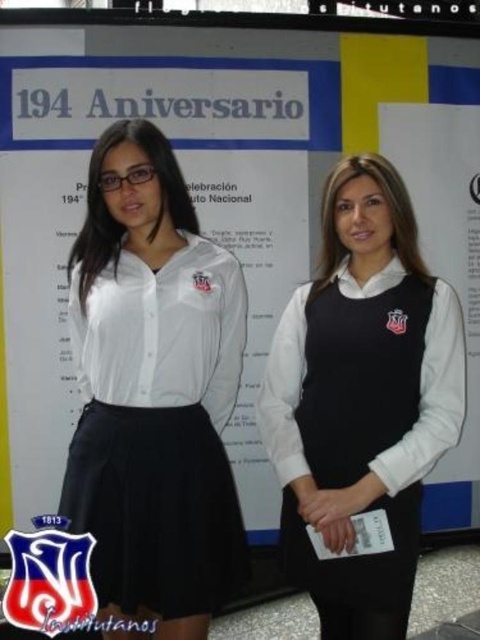
Question: Which of the following is the farthest from the observer?

Choices:
 (A) (301, 497)
 (B) (239, 308)

Answer: (B)

Question: Can you confirm if white matte shirt at center is bigger than black matte vest at center?

Choices:
 (A) no
 (B) yes

Answer: (B)

Question: Which point appears farthest from the camera in this image?

Choices:
 (A) (441, 385)
 (B) (223, 570)

Answer: (A)

Question: Is the position of white matte shirt at center more distant than that of black matte vest at center?

Choices:
 (A) yes
 (B) no

Answer: (B)

Question: Considering the relative positions of white matte shirt at center and black matte vest at center in the image provided, where is white matte shirt at center located with respect to black matte vest at center?

Choices:
 (A) below
 (B) above

Answer: (B)